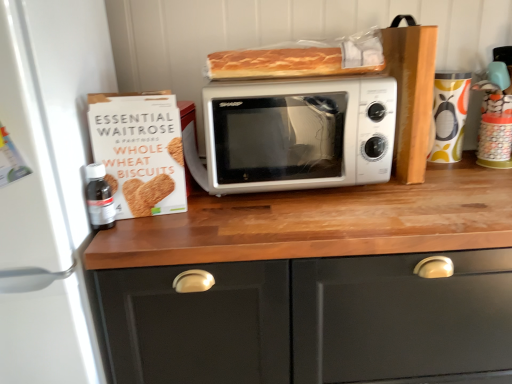
Find the location of a particular element. The width and height of the screenshot is (512, 384). vacant region in front of white cardboard box at left is located at coordinates (147, 238).